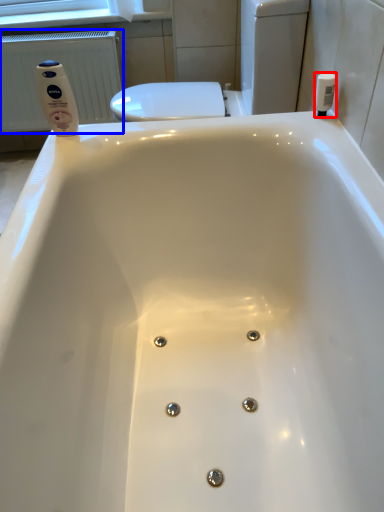
Question: Which object is further to the camera taking this photo, toiletry (highlighted by a red box) or radiator (highlighted by a blue box)?

Choices:
 (A) toiletry
 (B) radiator

Answer: (B)